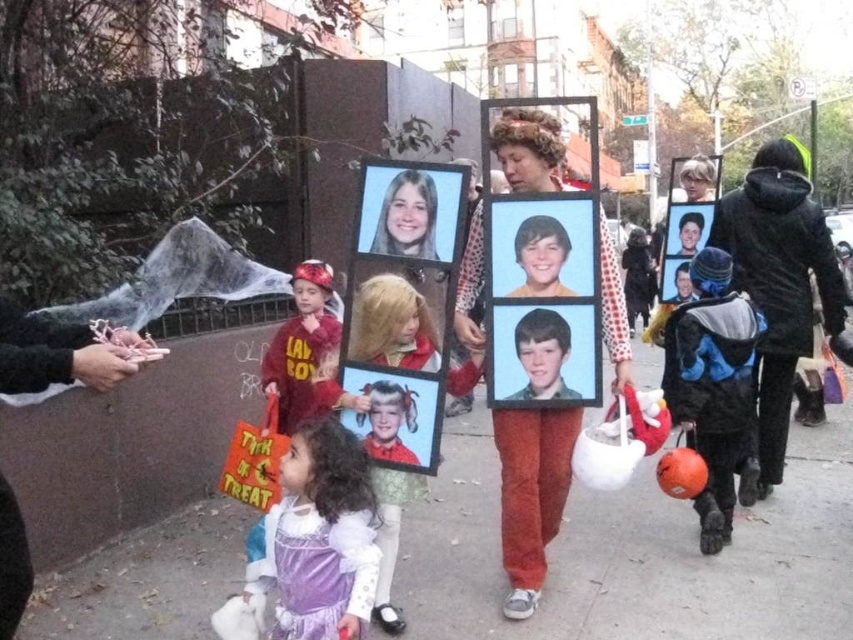
Question: Can you confirm if matte cardboard portraits at center is smaller than smooth skin portrait at center?

Choices:
 (A) yes
 (B) no

Answer: (B)

Question: Can you confirm if gray concrete sidewalk at center is positioned to the left of matte cardboard portraits at center?

Choices:
 (A) no
 (B) yes

Answer: (A)

Question: Which object appears farthest from the camera in this image?

Choices:
 (A) smooth plastic photo frame at center
 (B) shiny red helmet at center
 (C) matte plastic picture frame at center

Answer: (B)

Question: Estimate the real-world distances between objects in this image. Which object is closer to the smooth skin portrait at center?

Choices:
 (A) matte plastic picture frame at center
 (B) smooth plastic photo frame at center
 (C) shiny red helmet at center

Answer: (B)

Question: Is shiny red helmet at center thinner than smooth plastic photo frame at center?

Choices:
 (A) no
 (B) yes

Answer: (A)

Question: Which is farther from the velvet purple dress at lower center?

Choices:
 (A) shiny red helmet at center
 (B) gray concrete sidewalk at center

Answer: (B)